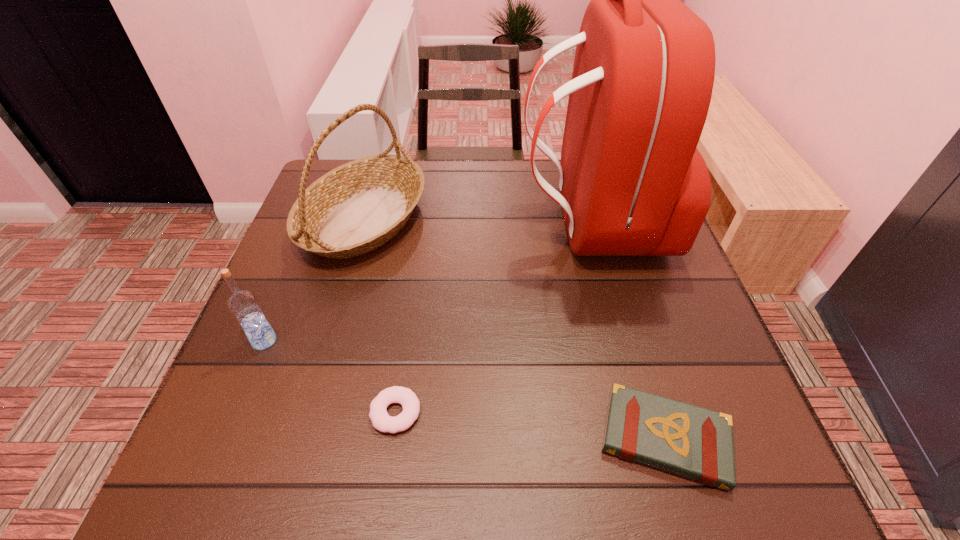
Locate an element on the screen. The height and width of the screenshot is (540, 960). the tallest object is located at coordinates (632, 183).

Locate an element on the screen. The width and height of the screenshot is (960, 540). basket is located at coordinates (357, 207).

Locate an element on the screen. the third tallest object is located at coordinates (243, 304).

I want to click on the third nearest object, so click(243, 304).

Image resolution: width=960 pixels, height=540 pixels. What are the coordinates of `book` in the screenshot? It's located at (693, 442).

Locate an element on the screen. The image size is (960, 540). doughnut is located at coordinates (381, 420).

You are a GUI agent. You are given a task and a screenshot of the screen. Output one action in this format:
    pyautogui.click(x=<x>, y=<y>)
    Task: Click on the vacant space located on the strap side of the backpack
    This screenshot has width=960, height=540.
    Given the screenshot: What is the action you would take?
    [376, 224]

You are a GUI agent. You are given a task and a screenshot of the screen. Output one action in this format:
    pyautogui.click(x=<x>, y=<y>)
    Task: Click on the free space located on the strap side of the backpack
    The height and width of the screenshot is (540, 960).
    Given the screenshot: What is the action you would take?
    pyautogui.click(x=492, y=224)

The width and height of the screenshot is (960, 540). I want to click on free region located 0.080m on the strap side of the backpack, so click(488, 224).

You are a GUI agent. You are given a task and a screenshot of the screen. Output one action in this format:
    pyautogui.click(x=<x>, y=<y>)
    Task: Click on the vacant space positioned 0.060m on the right of the basket
    This screenshot has height=540, width=960.
    Given the screenshot: What is the action you would take?
    pyautogui.click(x=448, y=219)